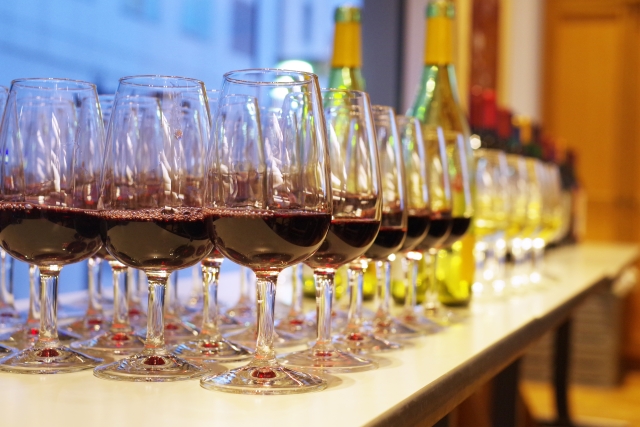
This screenshot has height=427, width=640. What are the coordinates of `wine bottles` in the screenshot? It's located at coord(445,96), coord(342,70), coord(491,131), coord(512,144), coord(536,152), coord(568,175), coord(557,162), coord(546,160).